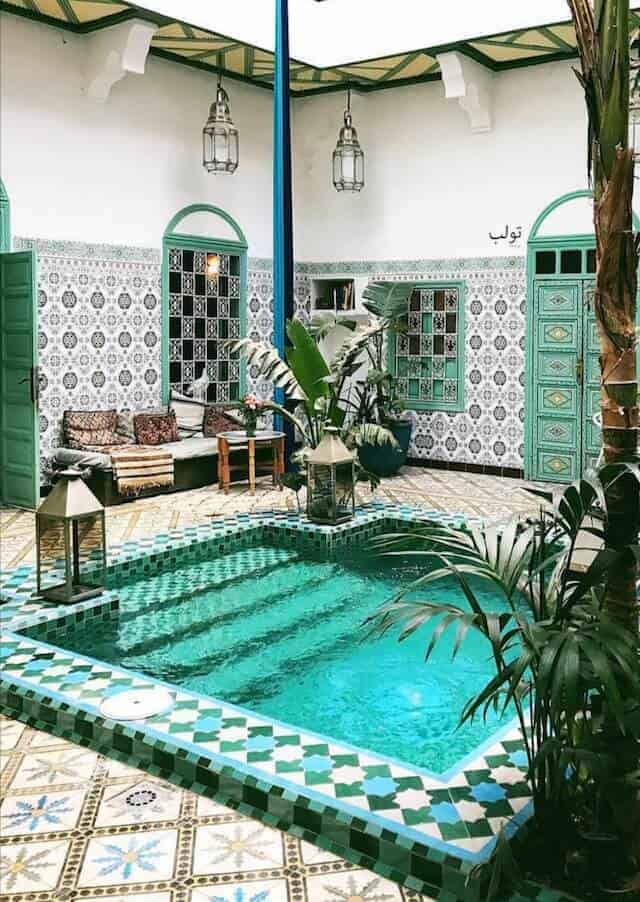
Find the location of a particular element. This screenshot has width=640, height=902. door is located at coordinates (20, 318).